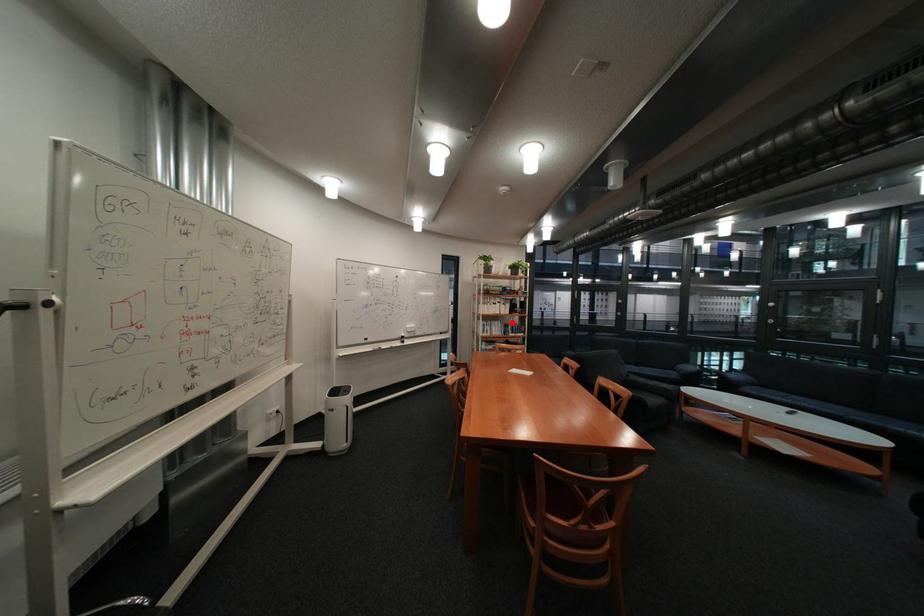
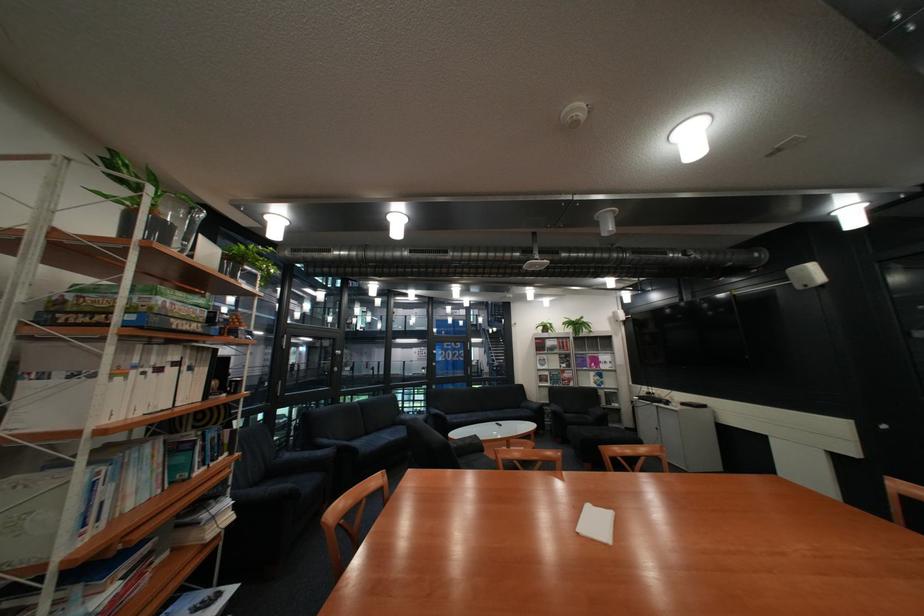
Find the pixel in the second image that matches the highlighted location in the first image.

(163, 448)